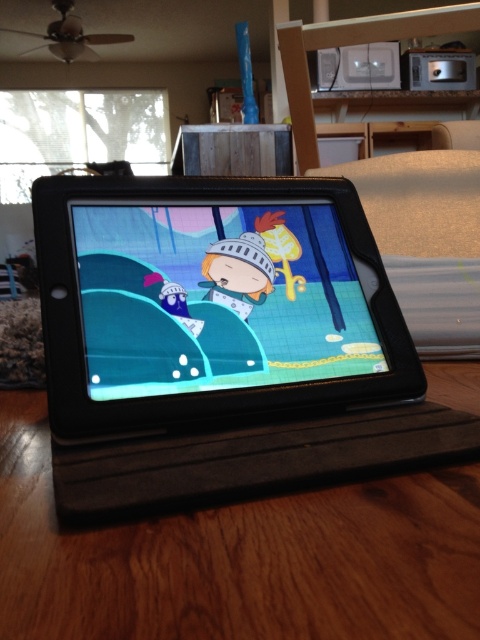
Between point (372, 541) and point (336, 296), which one is positioned in front?

Point (372, 541)

Where is `wooden table at center`? wooden table at center is located at coordinates (238, 557).

Locate an element on the screen. The image size is (480, 640). wooden table at center is located at coordinates (238, 557).